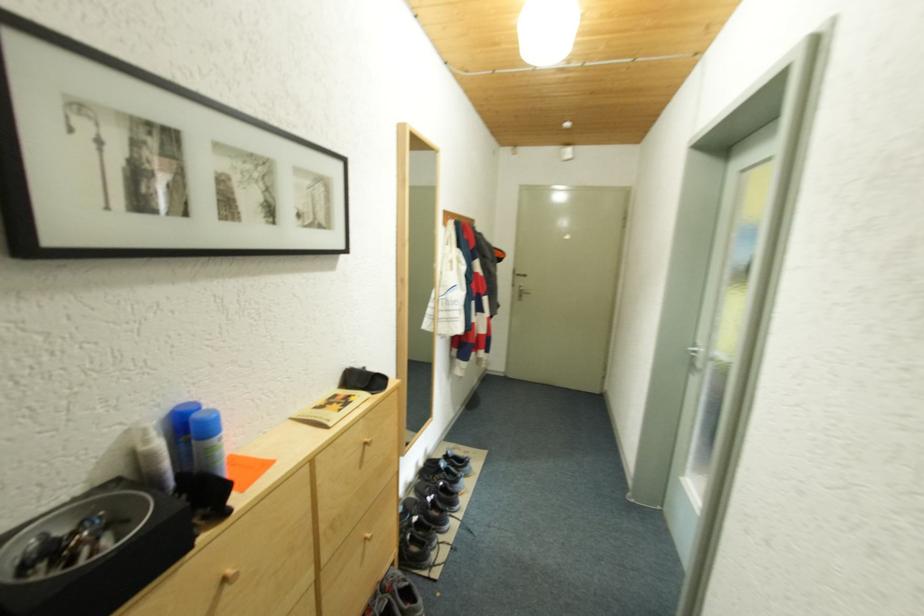
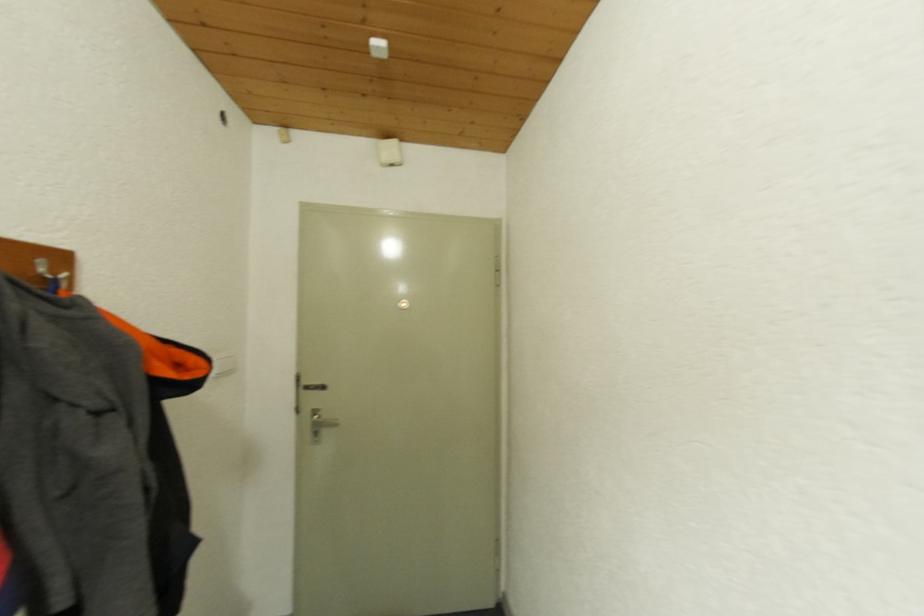
Question: What movement of the cameraman would produce the second image?

Choices:
 (A) Left
 (B) Right
 (C) Forward
 (D) Backward

Answer: (C)